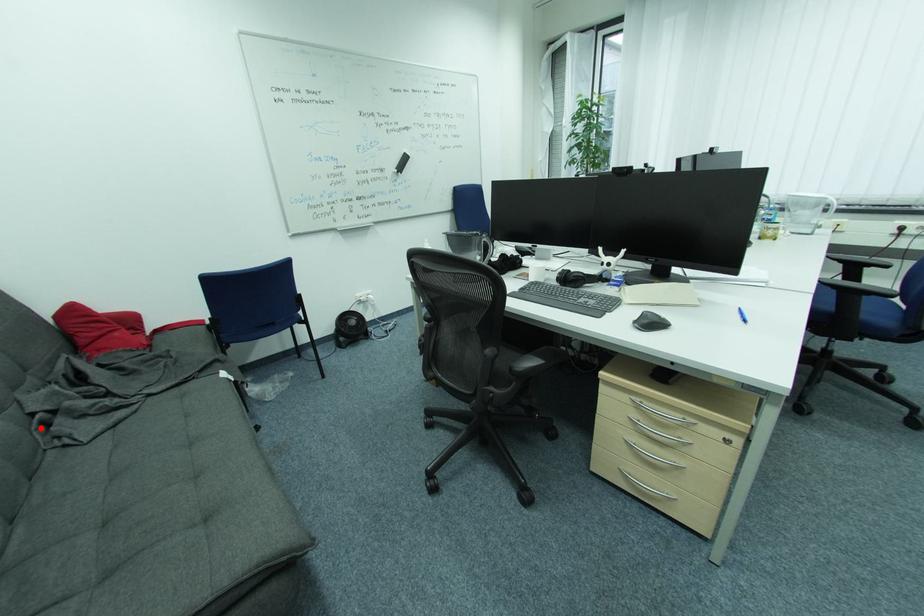
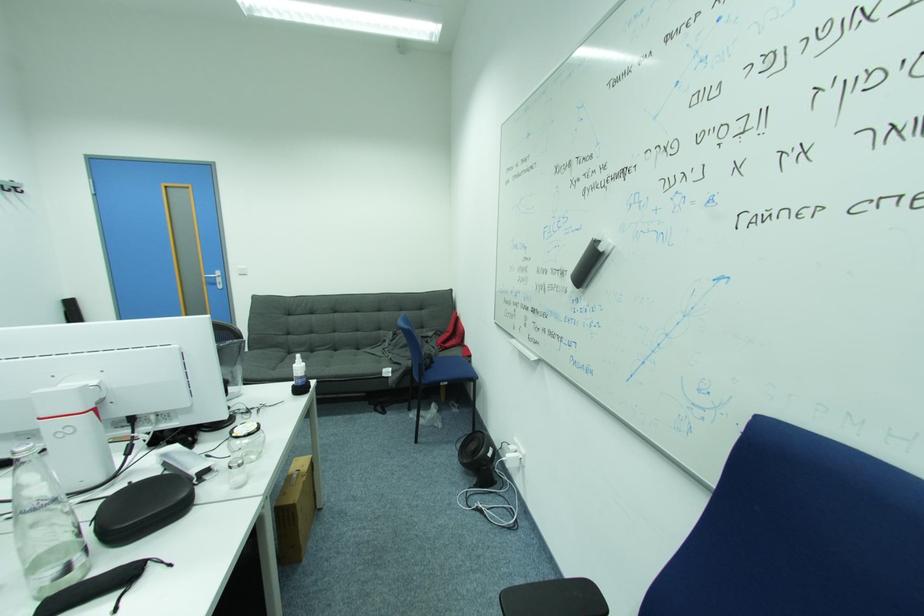
Where in the second image is the point corresponding to the highlighted location from the first image?

(388, 341)